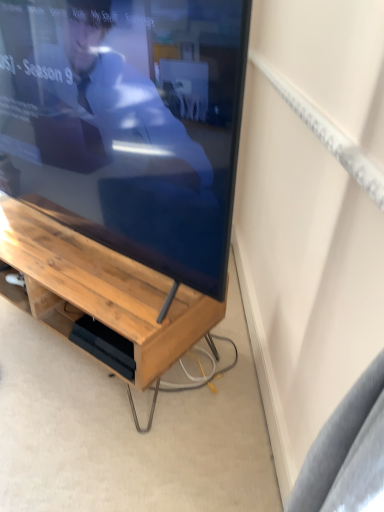
Question: From a real-world perspective, is matte wood tv at center positioned above or below wooden desk at center?

Choices:
 (A) below
 (B) above

Answer: (B)

Question: Considering the positions of matte wood tv at center and wooden desk at center in the image, is matte wood tv at center taller or shorter than wooden desk at center?

Choices:
 (A) short
 (B) tall

Answer: (B)

Question: Visually, is matte wood tv at center positioned to the left or to the right of wooden desk at center?

Choices:
 (A) right
 (B) left

Answer: (A)

Question: Is wooden desk at center to the left or to the right of matte wood tv at center in the image?

Choices:
 (A) left
 (B) right

Answer: (A)

Question: From the image's perspective, is wooden desk at center located above or below matte wood tv at center?

Choices:
 (A) above
 (B) below

Answer: (B)

Question: In terms of size, does wooden desk at center appear bigger or smaller than matte wood tv at center?

Choices:
 (A) small
 (B) big

Answer: (A)

Question: In terms of width, does wooden desk at center look wider or thinner when compared to matte wood tv at center?

Choices:
 (A) wide
 (B) thin

Answer: (A)